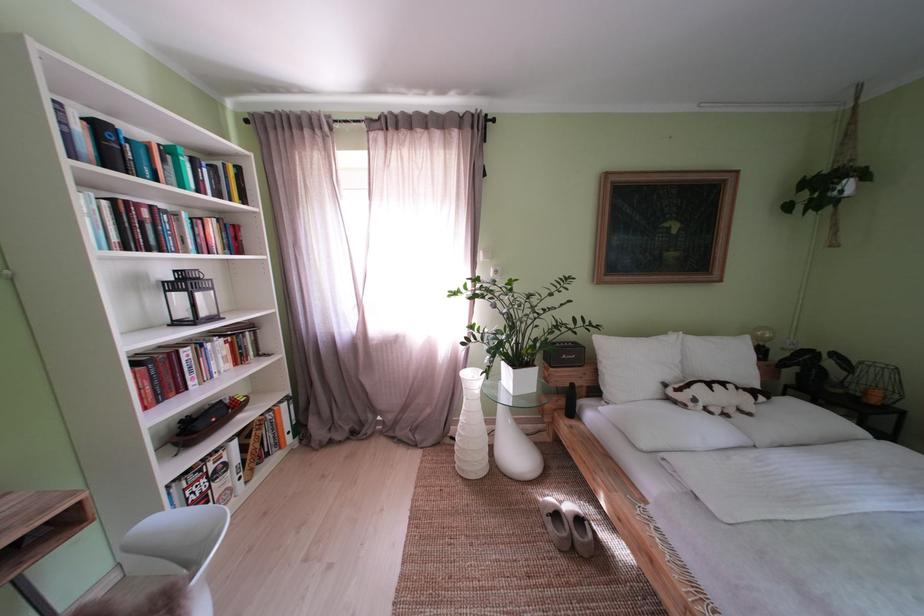
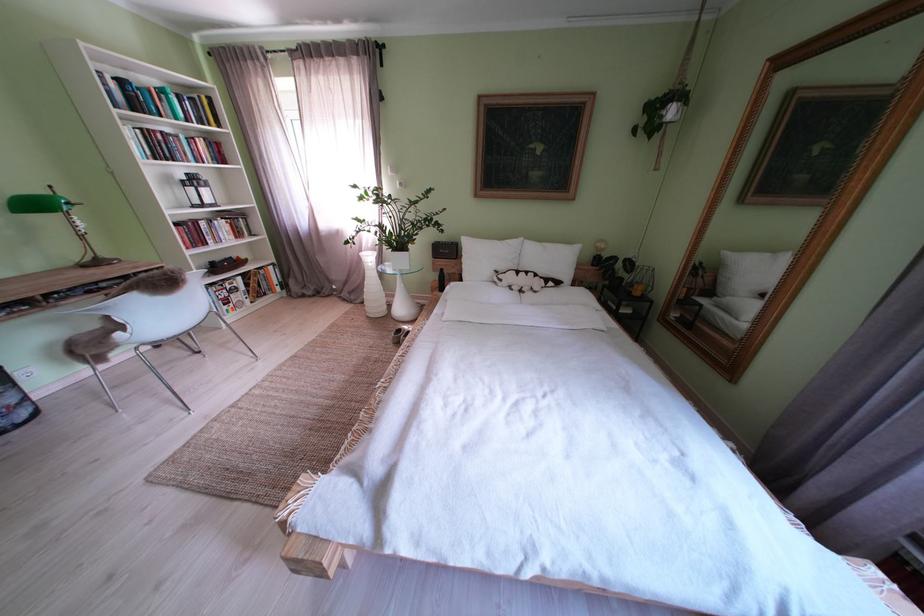
Find the pixel in the second image that matches (x=884, y=406) in the first image.

(648, 299)